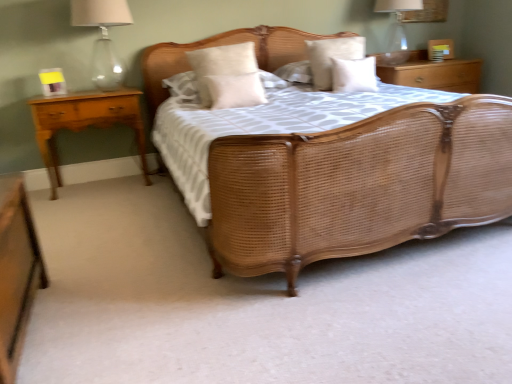
Question: Can you confirm if wooden nightstand at upper right, the first nightstand when ordered from back to front, is wider than matte glass lamp at upper left, which is the second bedside lamp in right-to-left order?

Choices:
 (A) yes
 (B) no

Answer: (A)

Question: Can you confirm if wooden nightstand at upper right, acting as the 3th nightstand starting from the bottom, is bigger than matte glass lamp at upper left, placed as the first bedside lamp when sorted from left to right?

Choices:
 (A) yes
 (B) no

Answer: (A)

Question: Can you confirm if wooden nightstand at upper right, acting as the 3th nightstand starting from the bottom, is taller than matte glass lamp at upper left, placed as the first bedside lamp when sorted from left to right?

Choices:
 (A) no
 (B) yes

Answer: (A)

Question: From a real-world perspective, is wooden nightstand at upper right, the 1th nightstand from the right, over matte glass lamp at upper left, the 2th bedside lamp when ordered from back to front?

Choices:
 (A) yes
 (B) no

Answer: (B)

Question: Is wooden nightstand at upper right, the third nightstand from the front, placed right next to matte glass lamp at upper left, placed as the first bedside lamp when sorted from left to right?

Choices:
 (A) no
 (B) yes

Answer: (A)

Question: In the image, is wooden nightstand at upper right, the first nightstand when ordered from back to front, on the left side or the right side of matte glass lampshade at upper right, the 2th bedside lamp from the front?

Choices:
 (A) left
 (B) right

Answer: (B)

Question: Do you think wooden nightstand at upper right, the first nightstand when ordered from back to front, is within matte glass lampshade at upper right, placed as the 2th bedside lamp when sorted from left to right, or outside of it?

Choices:
 (A) outside
 (B) inside

Answer: (A)

Question: Based on their sizes in the image, would you say wooden nightstand at upper right, positioned as the 3th nightstand in left-to-right order, is bigger or smaller than matte glass lampshade at upper right, the 1th bedside lamp from the back?

Choices:
 (A) small
 (B) big

Answer: (B)

Question: From a real-world perspective, is wooden nightstand at upper right, the first nightstand in the top-to-bottom sequence, positioned above or below matte glass lampshade at upper right, the 2th bedside lamp from the front?

Choices:
 (A) below
 (B) above

Answer: (A)

Question: Considering their positions, is matte glass lamp at upper left, which is the first bedside lamp from front to back, located in front of or behind light brown wood nightstand at left, which is the second nightstand in bottom-to-top order?

Choices:
 (A) behind
 (B) front

Answer: (B)

Question: From the image's perspective, relative to light brown wood nightstand at left, placed as the first nightstand when sorted from left to right, is matte glass lamp at upper left, placed as the first bedside lamp when sorted from left to right, above or below?

Choices:
 (A) above
 (B) below

Answer: (A)

Question: From a real-world perspective, relative to light brown wood nightstand at left, the third nightstand viewed from the right, is matte glass lamp at upper left, which is the first bedside lamp from front to back, vertically above or below?

Choices:
 (A) below
 (B) above

Answer: (B)

Question: In the image, is matte glass lamp at upper left, which is the second bedside lamp in right-to-left order, on the left side or the right side of light brown wood nightstand at left, which is the second nightstand in bottom-to-top order?

Choices:
 (A) left
 (B) right

Answer: (B)

Question: In terms of width, does white soft pillow at upper center, acting as the second pillow starting from the right, look wider or thinner when compared to woven wood bed at center?

Choices:
 (A) thin
 (B) wide

Answer: (A)

Question: Is white soft pillow at upper center, the 3th pillow in the left-to-right sequence, in front of or behind woven wood bed at center in the image?

Choices:
 (A) behind
 (B) front

Answer: (A)